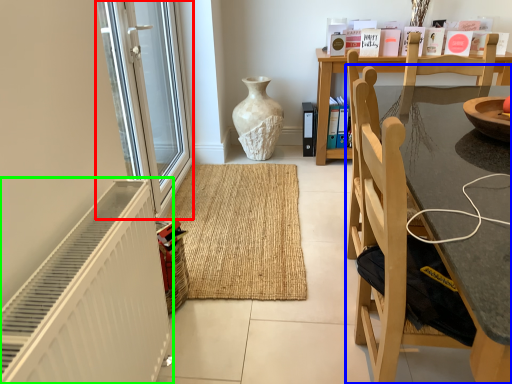
Question: Considering the real-world distances, which object is farthest from screen door (highlighted by a red box)? chair (highlighted by a blue box) or radiator (highlighted by a green box)?

Choices:
 (A) chair
 (B) radiator

Answer: (A)